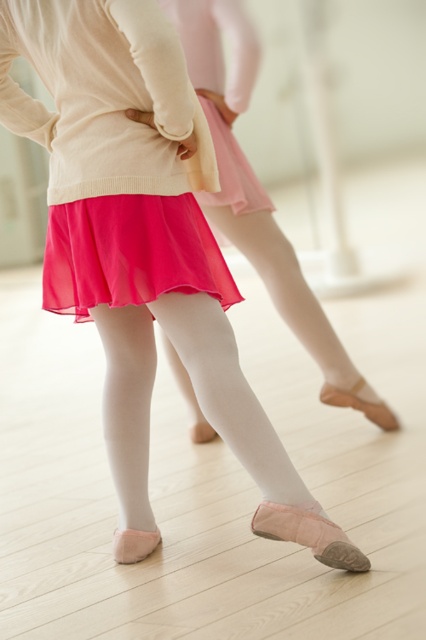
Question: Does pink chiffon skirt at center have a lesser width compared to pink satin ballet slipper at lower center?

Choices:
 (A) no
 (B) yes

Answer: (A)

Question: Which object appears closest to the camera in this image?

Choices:
 (A) pink satin ballet slipper at lower center
 (B) shiny chiffon skirt at center
 (C) pink chiffon skirt at center

Answer: (A)

Question: Can you confirm if shiny chiffon skirt at center is wider than pink satin ballet slipper at lower center?

Choices:
 (A) yes
 (B) no

Answer: (A)

Question: Among these objects, which one is farthest from the camera?

Choices:
 (A) pink satin ballet slipper at lower center
 (B) shiny chiffon skirt at center

Answer: (B)

Question: Is the position of pink chiffon skirt at center less distant than that of pink satin ballet slipper at lower center?

Choices:
 (A) yes
 (B) no

Answer: (B)

Question: Which point is farther from the camera taking this photo?

Choices:
 (A) (140, 289)
 (B) (267, 212)
 (C) (337, 538)

Answer: (B)